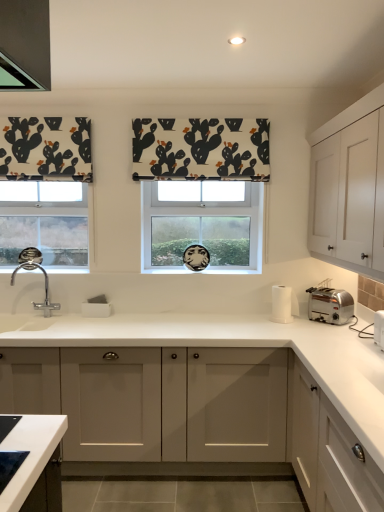
Locate an element on the screen. The image size is (384, 512). vacant space to the left of white paper towel holder at right, the second appliance positioned from the front is located at coordinates (261, 321).